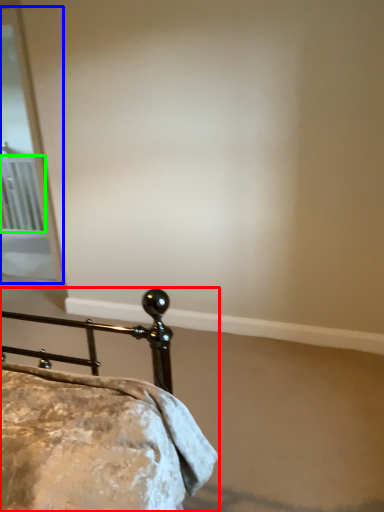
Question: Which object is the farthest from bed (highlighted by a red box)? Choose among these: screen door (highlighted by a blue box) or radiator (highlighted by a green box).

Choices:
 (A) screen door
 (B) radiator

Answer: (B)